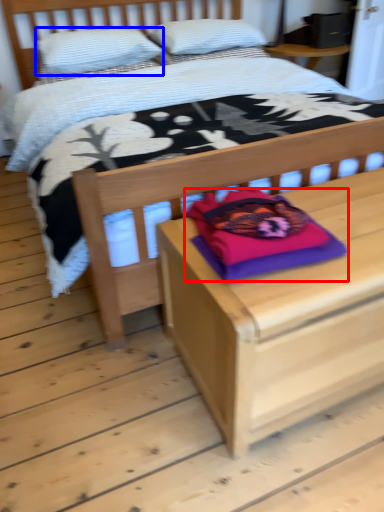
Question: Which object is closer to the camera taking this photo, pillow (highlighted by a red box) or pillow (highlighted by a blue box)?

Choices:
 (A) pillow
 (B) pillow

Answer: (A)